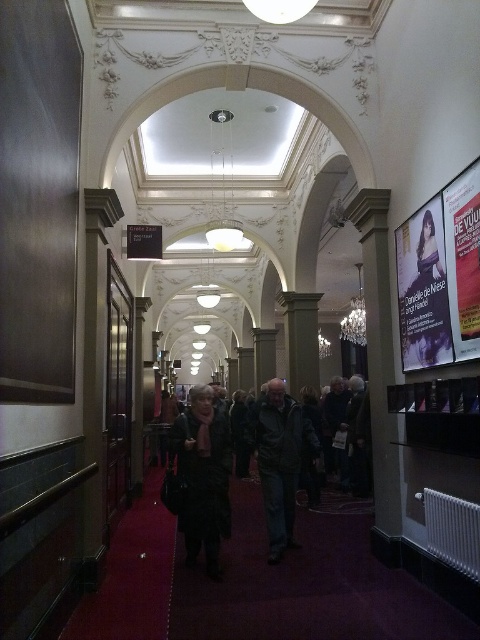
Question: Which of the following is the closest to the observer?

Choices:
 (A) dark gray coat at center
 (B) dark gray wool coat at center
 (C) matte paper poster at right
 (D) matte white poster at right

Answer: (C)

Question: Can you confirm if dark gray coat at center is thinner than matte white poster at right?

Choices:
 (A) yes
 (B) no

Answer: (B)

Question: Among these points, which one is nearest to the camera?

Choices:
 (A) (205, 513)
 (B) (408, 266)
 (C) (189, 552)

Answer: (B)

Question: Estimate the real-world distances between objects in this image. Which object is closer to the dark gray coat at center?

Choices:
 (A) dark gray wool coat at center
 (B) matte white poster at right

Answer: (A)

Question: Does dark green jacket at center come behind matte paper poster at right?

Choices:
 (A) no
 (B) yes

Answer: (B)

Question: Is dark gray coat at center positioned before matte paper poster at right?

Choices:
 (A) no
 (B) yes

Answer: (A)